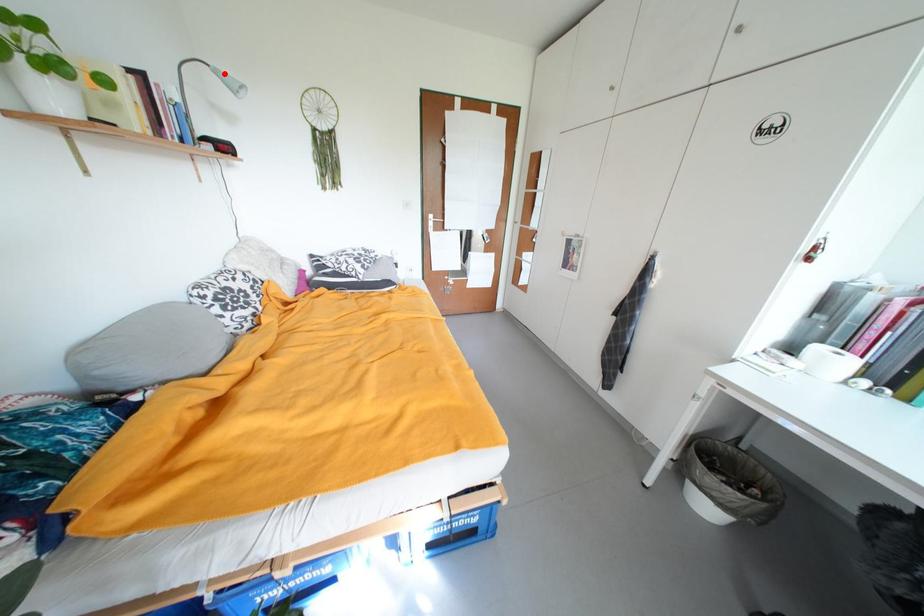
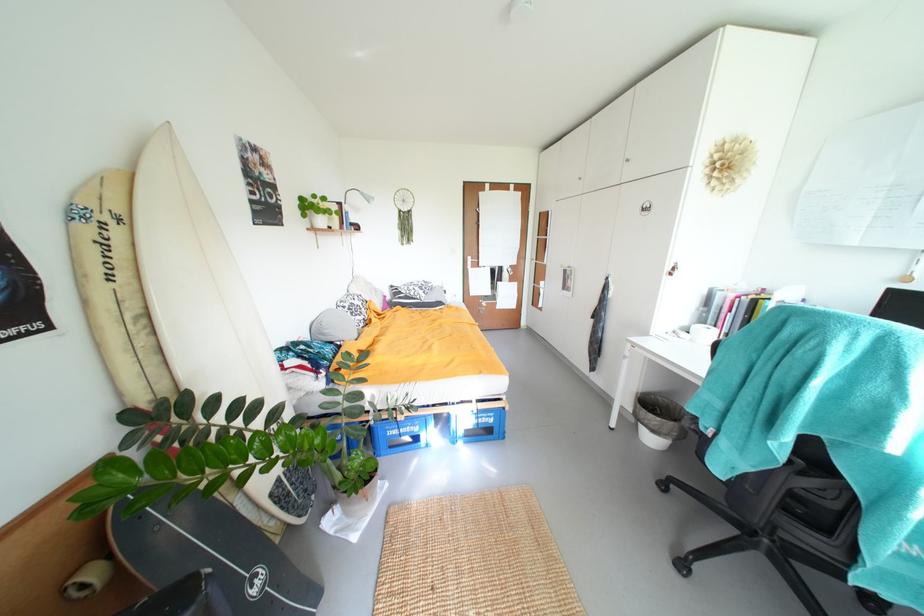
The point at the highlighted location is marked in the first image. Where is the corresponding point in the second image?

(370, 196)